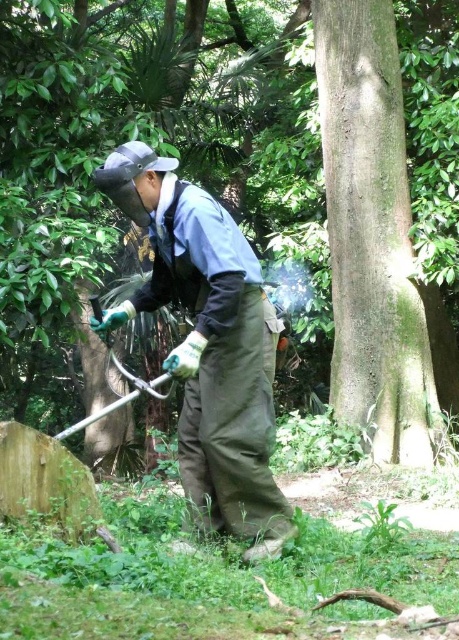
Question: Is green matte grass at lower center to the right of green fabric apron at center from the viewer's perspective?

Choices:
 (A) no
 (B) yes

Answer: (B)

Question: Which of the following is the closest to the observer?

Choices:
 (A) green fabric apron at center
 (B) green matte grass at lower center

Answer: (A)

Question: Among these points, which one is farthest from the camera?

Choices:
 (A) (351, 20)
 (B) (447, 364)

Answer: (B)

Question: Which of these objects is positioned closest to the green fabric apron at center?

Choices:
 (A) smooth brown tree trunk at right
 (B) green matte grass at lower center

Answer: (A)

Question: From the image, what is the correct spatial relationship of green matte grass at lower center in relation to smooth brown tree trunk at right?

Choices:
 (A) above
 (B) below

Answer: (A)

Question: Is green matte grass at lower center further to camera compared to smooth brown tree trunk at right?

Choices:
 (A) no
 (B) yes

Answer: (B)